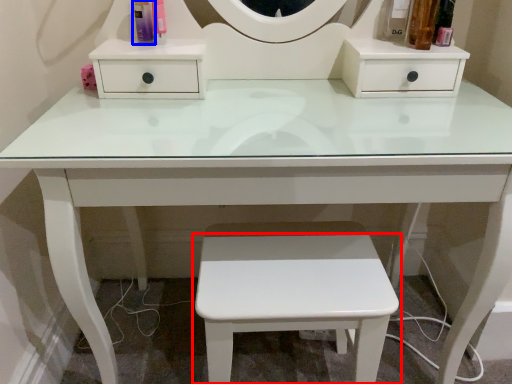
Question: Which object is closer to the camera taking this photo, stool (highlighted by a red box) or toiletry (highlighted by a blue box)?

Choices:
 (A) stool
 (B) toiletry

Answer: (A)